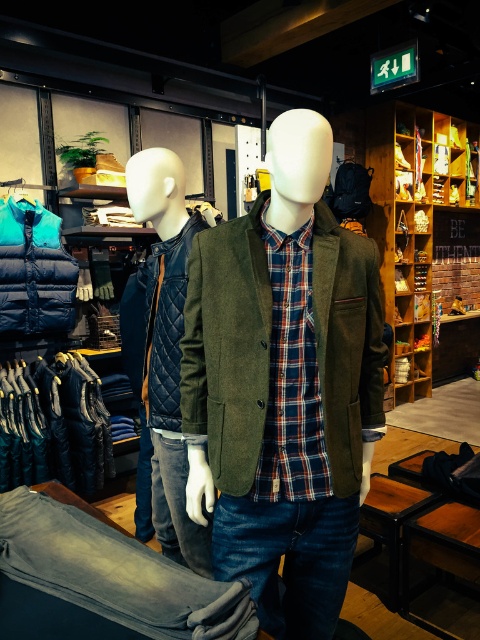
You are a customer in the clothing store and want to locate the plaid cotton shirt at center. Based on the store layout described, where should you look relative to the mannequins?

The plaid cotton shirt at center is located at point coordinates, so you should look at the central area of the store where the main mannequin is positioned, as the coordinates suggest it is centrally placed between the two mannequins.

You are a customer in the clothing store and want to know which item is positioned lower between the quilted leather jacket at left and the plaid cotton shirt at center. According to the store layout, which one is lower?

The quilted leather jacket at left is located below the plaid cotton shirt at center, so it is positioned lower.

You are a customer trying to decide between the denim pants at center and the blue down vest at left. Which item has a wider width?

The denim pants at center might be wider than blue down vest at left according to the description.